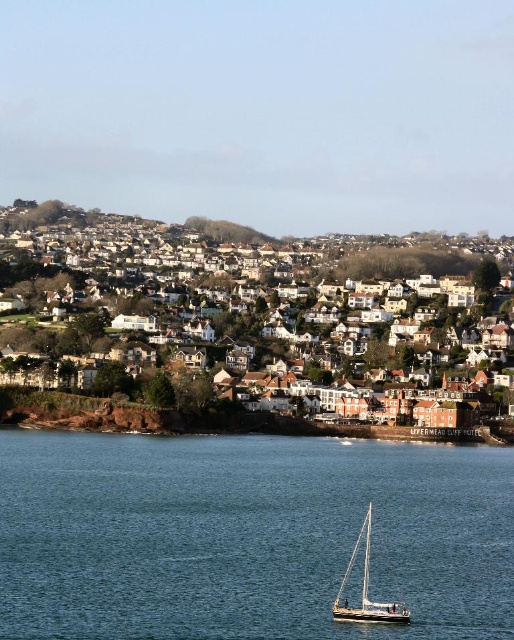
Can you confirm if blue water at lower center is thinner than white matte sailboat at center?

In fact, blue water at lower center might be wider than white matte sailboat at center.

Is blue water at lower center to the right of white matte sailboat at center from the viewer's perspective?

No, blue water at lower center is not to the right of white matte sailboat at center.

Who is more forward, [0,499] or [372,502]?

Point [0,499] is more forward.

Where is `blue water at lower center`? The height and width of the screenshot is (640, 514). blue water at lower center is located at coordinates (248, 536).

Can you confirm if white textured houses at center is thinner than white matte sailboat at center?

Incorrect, white textured houses at center's width is not less than white matte sailboat at center's.

Between point (47, 284) and point (347, 573), which one is positioned behind?

The point (47, 284) is behind.

Identify the location of white textured houses at center. (211, 317).

Who is shorter, blue water at lower center or white textured houses at center?

blue water at lower center

Is blue water at lower center further to camera compared to white textured houses at center?

No, it is not.

Describe the element at coordinates (248, 536) in the screenshot. I see `blue water at lower center` at that location.

I want to click on blue water at lower center, so click(x=248, y=536).